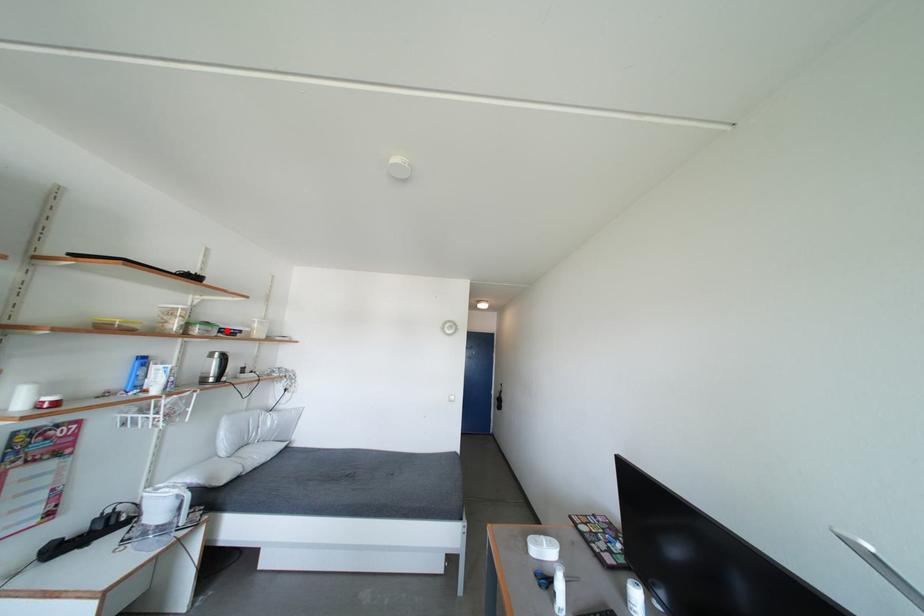
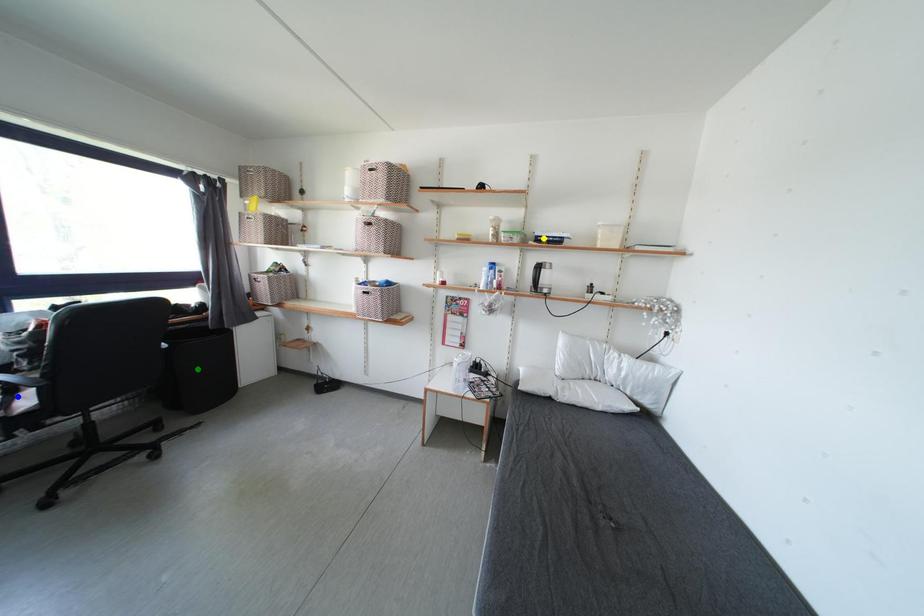
Question: I am providing you with two images of the same scene from different viewpoints. A red point is marked on the first image. You are given multiple points on the second image. In image 2, which mark is for the same physical point as the one in image 1?

Choices:
 (A) yellow point
 (B) green point
 (C) blue point

Answer: (A)